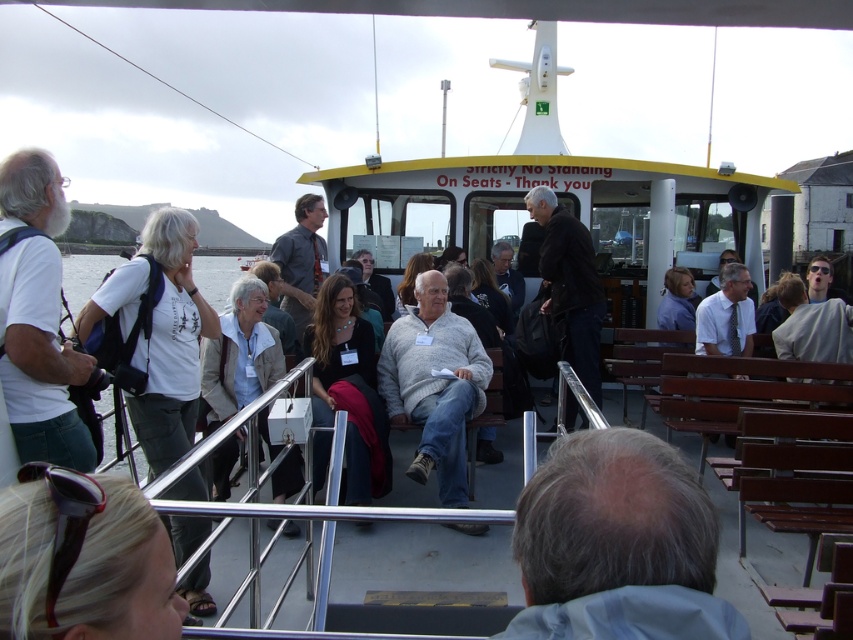
Question: Which of these objects is positioned closest to the white matte shirt at left?

Choices:
 (A) gray sweater at center
 (B) white cotton t-shirt at left
 (C) gray hair at center
 (D) light brown leather jacket at center

Answer: (B)

Question: Based on their relative distances, which object is farther from the light brown leather jacket at center?

Choices:
 (A) light beige jacket at center
 (B) shiny black sunglasses at upper left
 (C) gray sweater at center
 (D) matte black jacket at center

Answer: (B)

Question: Considering the real-world distances, which object is closest to the dark gray shirt at center?

Choices:
 (A) gray hair at center
 (B) light beige jacket at center
 (C) light brown leather jacket at center
 (D) matte black jacket at center

Answer: (C)

Question: Does white matte shirt at left appear over gray sweater at center?

Choices:
 (A) no
 (B) yes

Answer: (B)

Question: Can you confirm if white matte shirt at left is thinner than light beige jacket at center?

Choices:
 (A) yes
 (B) no

Answer: (A)

Question: Can you confirm if gray sweater at center is positioned below light beige jacket at center?

Choices:
 (A) no
 (B) yes

Answer: (B)